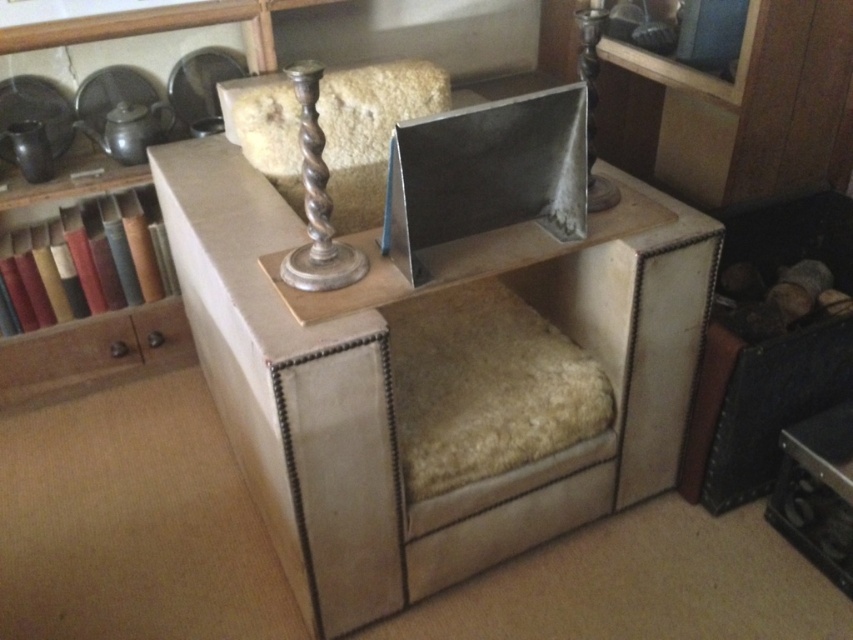
You are organizing items on a vintage cabinet and want to place a new decorative item between the brown wood drawer at left and the silver polished metal candlestick at upper center. Which side should you place it closer to ensure it fits within the space?

Since the brown wood drawer at left is wider than the silver polished metal candlestick at upper center, placing the new item closer to the silver polished metal candlestick at upper center would allow more space for it to fit between them.

You are arranging items on a vintage cabinet and want to place a new vase between the brown wood drawer at left and the silver polished metal candlestick at upper center. Based on their positions, where should you place the vase?

The brown wood drawer at left is located below the silver polished metal candlestick at upper center, so you should place the vase between them vertically. Since the drawer is below and the candlestick is above, position the vase in the middle vertically between the two items.

You are organizing a small event and need to place a 36 inch wide decorative item on the surface. The brown wood drawer at left and the silver polished metal candlestick at upper center are already there. Can the new item fit between them?

The distance between the brown wood drawer at left and the silver polished metal candlestick at upper center is 38.30 inches. Since the new item is 36 inches wide, it can fit between them with some space remaining.